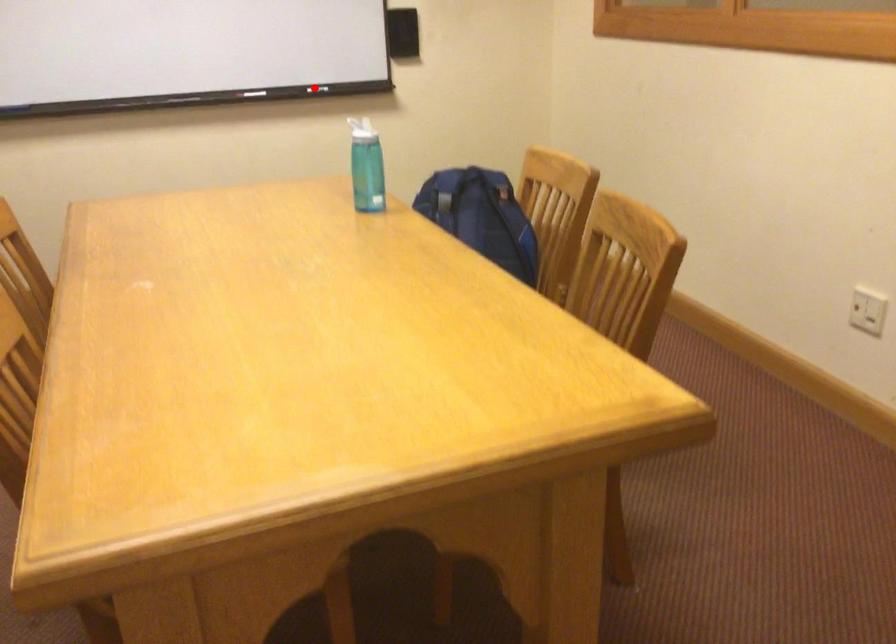
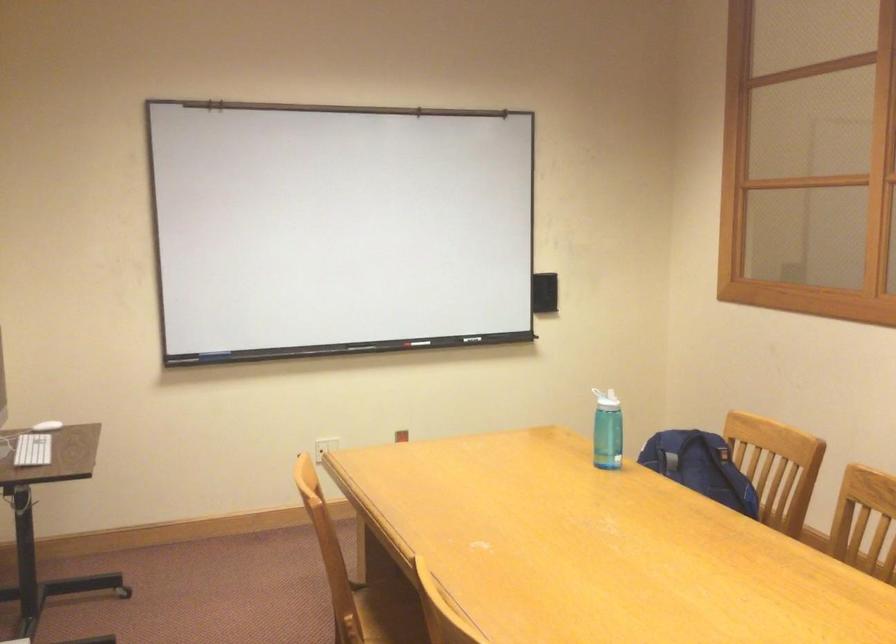
The point at the highlighted location is marked in the first image. Where is the corresponding point in the second image?

(476, 339)